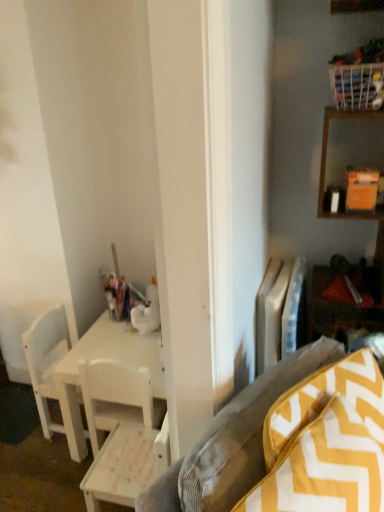
Question: From a real-world perspective, is white plastic radiator at center right over white matte chair at left, the second chair when ordered from right to left?

Choices:
 (A) no
 (B) yes

Answer: (B)

Question: Does white plastic radiator at center right lie behind white matte chair at left, the second chair positioned from the front?

Choices:
 (A) no
 (B) yes

Answer: (A)

Question: Is white plastic radiator at center right positioned far away from white matte chair at left, the second chair when ordered from right to left?

Choices:
 (A) no
 (B) yes

Answer: (A)

Question: From the image's perspective, is white plastic radiator at center right beneath white matte chair at left, acting as the first chair starting from the left?

Choices:
 (A) no
 (B) yes

Answer: (A)

Question: Is white matte chair at left, which is the first chair in back-to-front order, located within white plastic radiator at center right?

Choices:
 (A) yes
 (B) no

Answer: (B)

Question: From the image's perspective, is yellow zigzag-patterned cushion at lower right above or below white wood desk at center?

Choices:
 (A) above
 (B) below

Answer: (A)

Question: Is yellow zigzag-patterned cushion at lower right wider or thinner than white wood desk at center?

Choices:
 (A) thin
 (B) wide

Answer: (A)

Question: From a real-world perspective, is yellow zigzag-patterned cushion at lower right above or below white wood desk at center?

Choices:
 (A) below
 (B) above

Answer: (B)

Question: Is yellow zigzag-patterned cushion at lower right in front of or behind white wood desk at center in the image?

Choices:
 (A) front
 (B) behind

Answer: (A)

Question: From a real-world perspective, relative to white plastic radiator at center right, is white matte chair at left, acting as the first chair starting from the left, vertically above or below?

Choices:
 (A) below
 (B) above

Answer: (A)

Question: From the image's perspective, is white matte chair at left, the second chair positioned from the front, above or below white plastic radiator at center right?

Choices:
 (A) above
 (B) below

Answer: (B)

Question: Considering the positions of white matte chair at left, the second chair when ordered from right to left, and white plastic radiator at center right in the image, is white matte chair at left, the second chair when ordered from right to left, wider or thinner than white plastic radiator at center right?

Choices:
 (A) thin
 (B) wide

Answer: (B)

Question: Is white matte chair at left, acting as the first chair starting from the left, spatially inside white plastic radiator at center right, or outside of it?

Choices:
 (A) outside
 (B) inside

Answer: (A)

Question: Is point (117, 457) closer or farther from the camera than point (258, 330)?

Choices:
 (A) closer
 (B) farther

Answer: (A)

Question: In terms of height, does white wood chair at lower left, which ranks as the 2th chair in left-to-right order, look taller or shorter compared to white plastic radiator at center right?

Choices:
 (A) tall
 (B) short

Answer: (A)